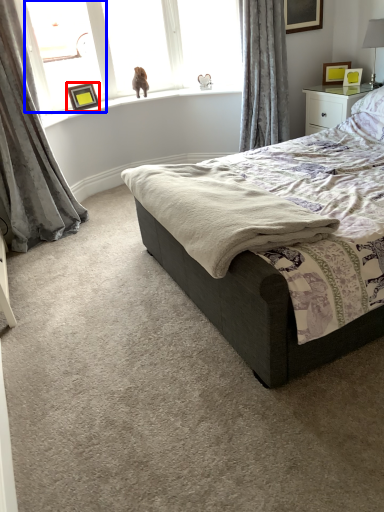
Question: Which object is further to the camera taking this photo, picture frame (highlighted by a red box) or window screen (highlighted by a blue box)?

Choices:
 (A) picture frame
 (B) window screen

Answer: (A)